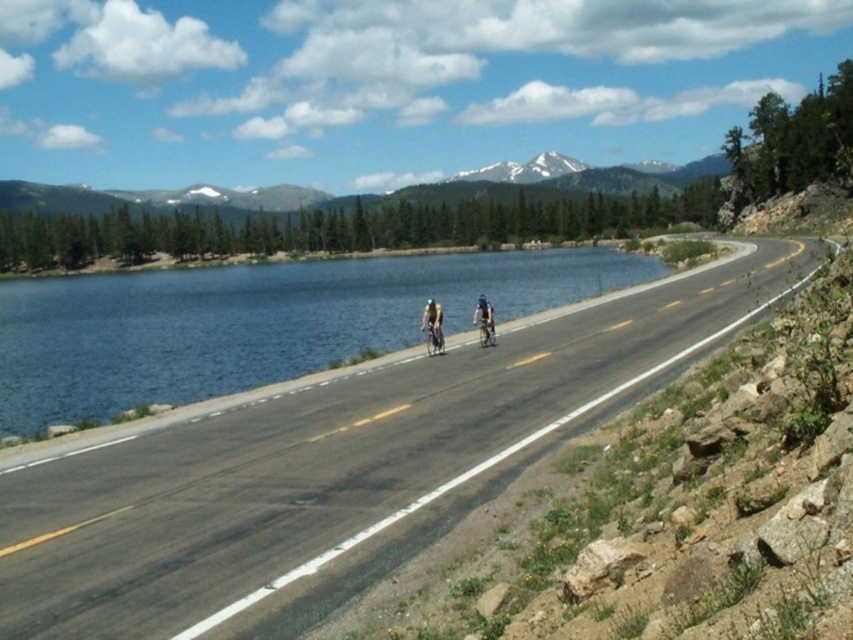
Question: Estimate the real-world distances between objects in this image. Which object is farther from the matte black bicycle at center?

Choices:
 (A) white helmeted cyclist at center
 (B) blue fabric helmet at center

Answer: (B)

Question: Does asphalt road at center have a lesser width compared to blue fabric helmet at center?

Choices:
 (A) no
 (B) yes

Answer: (A)

Question: Does asphalt road at center have a larger size compared to matte black bicycle at center?

Choices:
 (A) no
 (B) yes

Answer: (B)

Question: Which object is positioned closest to the blue water at center?

Choices:
 (A) blue fabric helmet at center
 (B) matte black bicycle at center
 (C) white helmeted cyclist at center

Answer: (B)

Question: Considering the relative positions of asphalt road at center and white helmeted cyclist at center in the image provided, where is asphalt road at center located with respect to white helmeted cyclist at center?

Choices:
 (A) below
 (B) above

Answer: (A)

Question: Which point is closer to the camera?

Choices:
 (A) shiny metallic bicycle at center
 (B) blue fabric helmet at center

Answer: (A)